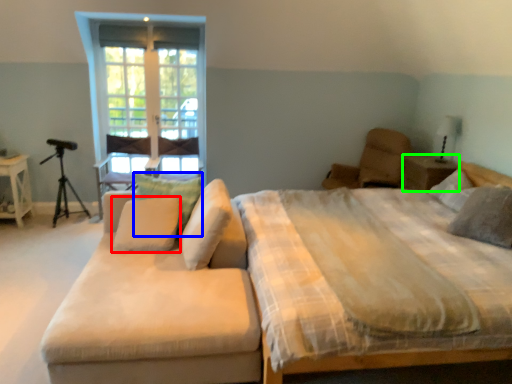
Question: Estimate the real-world distances between objects in this image. Which object is closer to pillow (highlighted by a red box), pillow (highlighted by a blue box) or nightstand (highlighted by a green box)?

Choices:
 (A) pillow
 (B) nightstand

Answer: (A)